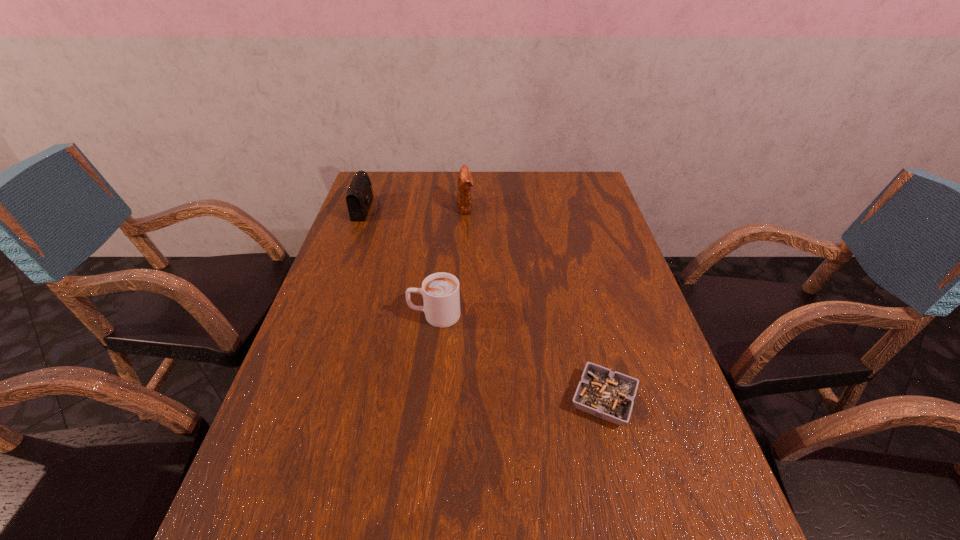
This screenshot has height=540, width=960. In order to click on vacant region located 0.170m on the side with the handle of the second nearest object in this screenshot , I will do `click(341, 315)`.

What are the coordinates of `vacant area situated on the front flap of the shorter clutch bag` in the screenshot? It's located at (424, 209).

Locate an element on the screen. vacant space located on the back of the shortest object is located at coordinates click(x=590, y=343).

The height and width of the screenshot is (540, 960). Identify the location of object situated at the left edge. (359, 197).

Where is `object positioned at the right edge`? This screenshot has width=960, height=540. object positioned at the right edge is located at coordinates (609, 395).

Where is `object that is at the far left corner`? object that is at the far left corner is located at coordinates (359, 197).

This screenshot has height=540, width=960. In the image, there is a desktop. In order to click on vacant space at the far edge in this screenshot , I will do coord(413,185).

This screenshot has width=960, height=540. In the image, there is a desktop. Identify the location of vacant space at the left edge. (329, 326).

Where is `vacant area at the right edge of the desktop`? Image resolution: width=960 pixels, height=540 pixels. vacant area at the right edge of the desktop is located at coordinates (565, 212).

This screenshot has height=540, width=960. Find the location of `vacant space at the far right corner`. vacant space at the far right corner is located at coordinates (564, 181).